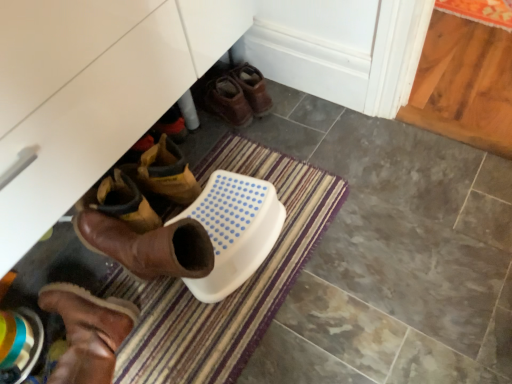
What do you see at coordinates (236, 290) in the screenshot? The height and width of the screenshot is (384, 512). I see `striped carpet at lower center` at bounding box center [236, 290].

What are the coordinates of `brown suede boot at lower left, which is the second footwear in top-to-bottom order` in the screenshot? It's located at (88, 332).

This screenshot has height=384, width=512. I want to click on striped carpet at lower center, so click(236, 290).

Could you measure the distance between striped carpet at lower center and brown suede boot at lower left, which is the first footwear in left-to-right order?

A distance of 9.45 inches exists between striped carpet at lower center and brown suede boot at lower left, which is the first footwear in left-to-right order.

What are the coordinates of `footwear in front of the striped carpet at lower center` in the screenshot? It's located at (88, 332).

Could you tell me if striped carpet at lower center is facing brown suede boot at lower left, the second footwear when ordered from right to left?

No.

Is brown suede boot at lower left, the first footwear from the bottom, facing towards brown leather boots at center, placed as the first footwear when sorted from right to left?

No, brown suede boot at lower left, the first footwear from the bottom, is not aimed at brown leather boots at center, placed as the first footwear when sorted from right to left.

Relative to brown leather boots at center, which is the 2th footwear in bottom-to-top order, is brown suede boot at lower left, the first footwear from the bottom, in front or behind?

In the image, brown suede boot at lower left, the first footwear from the bottom, appears in front of brown leather boots at center, which is the 2th footwear in bottom-to-top order.

Which of these two, brown suede boot at lower left, which is the second footwear in top-to-bottom order, or brown leather boots at center, which is the 2th footwear in bottom-to-top order, is thinner?

brown leather boots at center, which is the 2th footwear in bottom-to-top order.

From the image's perspective, is brown suede boot at lower left, which is the first footwear in left-to-right order, located above or below brown leather boots at center, which is the 2th footwear in bottom-to-top order?

brown suede boot at lower left, which is the first footwear in left-to-right order, is situated lower than brown leather boots at center, which is the 2th footwear in bottom-to-top order, in the image.

Does striped carpet at lower center touch brown leather boots at center, the 2th footwear when ordered from left to right?

No, striped carpet at lower center is not beside brown leather boots at center, the 2th footwear when ordered from left to right.

Looking at this image, is brown leather boots at center, acting as the 1th footwear starting from the back, surrounded by striped carpet at lower center?

Definitely not — brown leather boots at center, acting as the 1th footwear starting from the back, is not inside striped carpet at lower center.

Looking at their sizes, would you say striped carpet at lower center is wider or thinner than brown leather boots at center, which is the 2th footwear in bottom-to-top order?

Considering their sizes, striped carpet at lower center looks broader than brown leather boots at center, which is the 2th footwear in bottom-to-top order.

Is brown leather boots at center, which is the 2th footwear in bottom-to-top order, far away from striped carpet at lower center?

No, there isn't a large distance between brown leather boots at center, which is the 2th footwear in bottom-to-top order, and striped carpet at lower center.

Considering the sizes of objects brown leather boots at center, the 2th footwear when ordered from left to right, and striped carpet at lower center in the image provided, who is taller, brown leather boots at center, the 2th footwear when ordered from left to right, or striped carpet at lower center?

Standing taller between the two is brown leather boots at center, the 2th footwear when ordered from left to right.

From the image's perspective, between brown leather boots at center, which is the 2th footwear in bottom-to-top order, and striped carpet at lower center, which one is located above?

brown leather boots at center, which is the 2th footwear in bottom-to-top order, from the image's perspective.

Considering the positions of points (78, 359) and (245, 312), is point (78, 359) farther from camera compared to point (245, 312)?

No, (78, 359) is closer to viewer.

Is brown suede boot at lower left, which is the 2th footwear in back-to-front order, outside of striped carpet at lower center?

That's correct, brown suede boot at lower left, which is the 2th footwear in back-to-front order, is outside of striped carpet at lower center.

Considering the sizes of objects brown suede boot at lower left, the first footwear from the bottom, and striped carpet at lower center in the image provided, who is bigger, brown suede boot at lower left, the first footwear from the bottom, or striped carpet at lower center?

striped carpet at lower center is bigger.

Considering the sizes of brown leather boots at center, acting as the 1th footwear starting from the back, and brown suede boot at lower left, which is the second footwear in top-to-bottom order, in the image, is brown leather boots at center, acting as the 1th footwear starting from the back, bigger or smaller than brown suede boot at lower left, which is the second footwear in top-to-bottom order,?

Considering their sizes, brown leather boots at center, acting as the 1th footwear starting from the back, takes up less space than brown suede boot at lower left, which is the second footwear in top-to-bottom order.

How many degrees apart are the facing directions of brown leather boots at center, the second footwear when ordered from front to back, and brown suede boot at lower left, the second footwear when ordered from right to left?

There is a 36.9-degree angle between the facing directions of brown leather boots at center, the second footwear when ordered from front to back, and brown suede boot at lower left, the second footwear when ordered from right to left.

Is brown leather boots at center, the 2th footwear when ordered from left to right, inside or outside of brown suede boot at lower left, which is the first footwear in left-to-right order?

The correct answer is: outside.

There is a striped carpet at lower center. Where is `the 2nd footwear above it (from a real-world perspective)`? This screenshot has width=512, height=384. the 2nd footwear above it (from a real-world perspective) is located at coordinates (88, 332).

You are a GUI agent. You are given a task and a screenshot of the screen. Output one action in this format:
    pyautogui.click(x=<x>, y=<y>)
    Task: Click on the footwear on the left of brown leather boots at center, the second footwear when ordered from front to back
    Image resolution: width=512 pixels, height=384 pixels.
    Given the screenshot: What is the action you would take?
    pyautogui.click(x=88, y=332)

Which object lies nearer to the anchor point brown leather boots at center, acting as the 1th footwear starting from the back, brown suede boot at lower left, placed as the 1th footwear when sorted from front to back, or striped carpet at lower center?

striped carpet at lower center lies closer to brown leather boots at center, acting as the 1th footwear starting from the back, than the other object.

Which object lies further to the anchor point brown leather boots at center, the 2th footwear when ordered from left to right, striped carpet at lower center or brown suede boot at lower left, which is the 2th footwear in back-to-front order?

Based on the image, brown suede boot at lower left, which is the 2th footwear in back-to-front order, appears to be further to brown leather boots at center, the 2th footwear when ordered from left to right.

Based on their spatial positions, is brown leather boots at center, which is the 2th footwear in bottom-to-top order, or brown suede boot at lower left, the second footwear when ordered from right to left, further from striped carpet at lower center?

brown leather boots at center, which is the 2th footwear in bottom-to-top order, is positioned further to the anchor striped carpet at lower center.

Looking at the image, which one is located further to brown suede boot at lower left, placed as the 1th footwear when sorted from front to back, brown leather boots at center, the second footwear when ordered from front to back, or striped carpet at lower center?

The object further to brown suede boot at lower left, placed as the 1th footwear when sorted from front to back, is brown leather boots at center, the second footwear when ordered from front to back.

Looking at the image, which one is located further to brown suede boot at lower left, placed as the 1th footwear when sorted from front to back, striped carpet at lower center or brown leather boots at center, the 2th footwear when ordered from left to right?

The object further to brown suede boot at lower left, placed as the 1th footwear when sorted from front to back, is brown leather boots at center, the 2th footwear when ordered from left to right.

Considering their positions, is brown suede boot at lower left, which is the 2th footwear in back-to-front order, positioned further to striped carpet at lower center than brown leather boots at center, arranged as the first footwear when viewed from the top?

brown leather boots at center, arranged as the first footwear when viewed from the top, lies further to striped carpet at lower center than the other object.

Locate an element on the screen. Image resolution: width=512 pixels, height=384 pixels. bath mat that lies between brown leather boots at center, the 2th footwear when ordered from left to right, and brown suede boot at lower left, placed as the 1th footwear when sorted from front to back, from top to bottom is located at coordinates (236, 290).